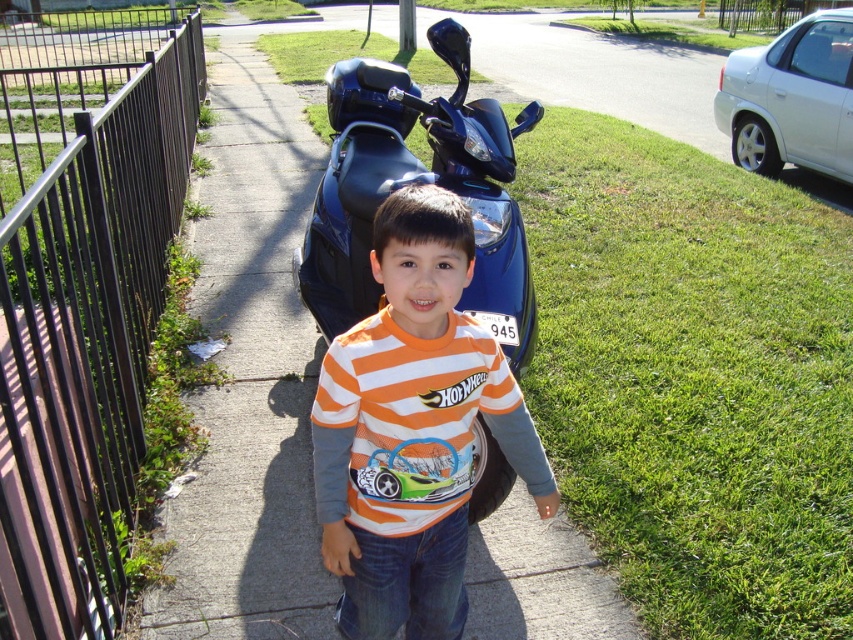
In the scene shown: You are a delivery robot that needs to place a small package on the smooth concrete pavement at center and the orange striped shirt at center. Which surface can you place the package on without it being obstructed by the other object?

The smooth concrete pavement at center has a larger size compared to orange striped shirt at center, so you can place the package on the smooth concrete pavement at center without obstruction.

You are a delivery robot trying to navigate around the black metal fence at left located at point (86, 342). The robot has a turning radius of 1.2 meters. Can you safely navigate around the fence without hitting it?

The black metal fence at left is located at point (86, 342). Since the robot has a turning radius of 1.2 meters, it can safely navigate around the fence without hitting it as long as there is sufficient space to maneuver around the fence at that point.

You are a delivery robot that is 1.5 meters tall. You are standing on the smooth concrete pavement at center and want to reach a delivery point located 2.31 meters away from you. Can you safely navigate to the delivery point without any obstacles?

The smooth concrete pavement at center and viewer are 2.31 meters apart, so yes, the delivery robot can safely navigate to the delivery point since the distance matches and there are no obstacles mentioned on the smooth concrete pavement at center.